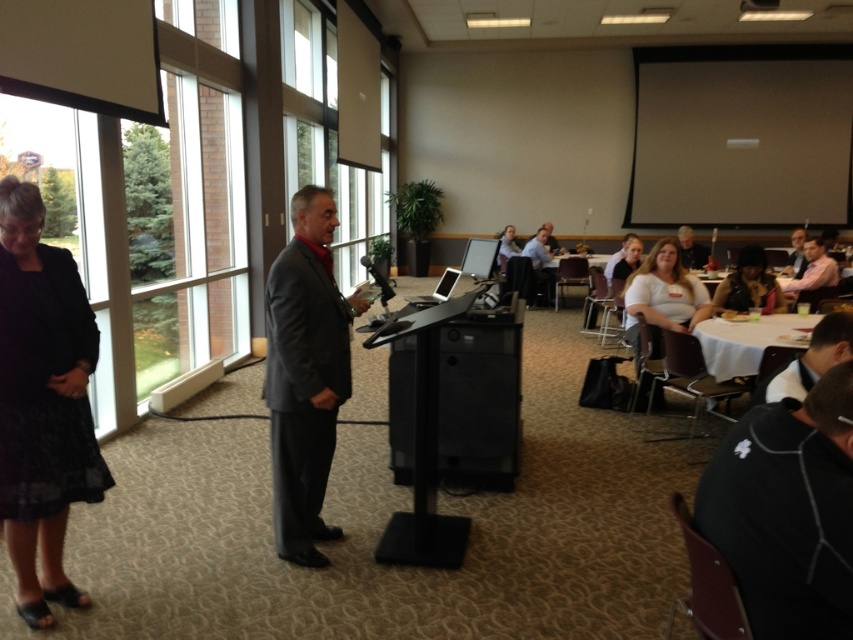
Question: Does light blue shirt at center appear on the right side of black glossy projector at upper center?

Choices:
 (A) yes
 (B) no

Answer: (B)

Question: Which point appears farthest from the camera in this image?

Choices:
 (A) (77, 406)
 (B) (553, 273)
 (C) (824, 358)

Answer: (B)

Question: Can you confirm if black textured dress at left is positioned to the right of white matte shirt at center?

Choices:
 (A) no
 (B) yes

Answer: (A)

Question: Among these points, which one is farthest from the camera?

Choices:
 (A) (289, 547)
 (B) (782, 272)
 (C) (699, 308)
 (D) (683, 241)

Answer: (D)

Question: From the image, what is the correct spatial relationship of dark gray suit at center in relation to matte black shirt at center?

Choices:
 (A) below
 (B) above

Answer: (A)

Question: Among these objects, which one is farthest from the camera?

Choices:
 (A) white shirt at lower right
 (B) white matte shirt at center
 (C) pink shirt at right
 (D) dark gray suit at center

Answer: (C)